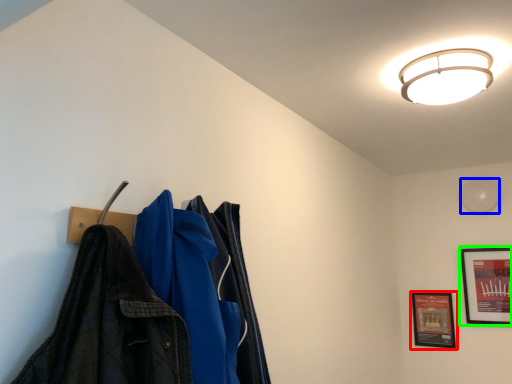
Question: Which object is positioned farthest from picture frame (highlighted by a red box)? Select from light (highlighted by a blue box) and picture frame (highlighted by a green box).

Choices:
 (A) light
 (B) picture frame

Answer: (A)